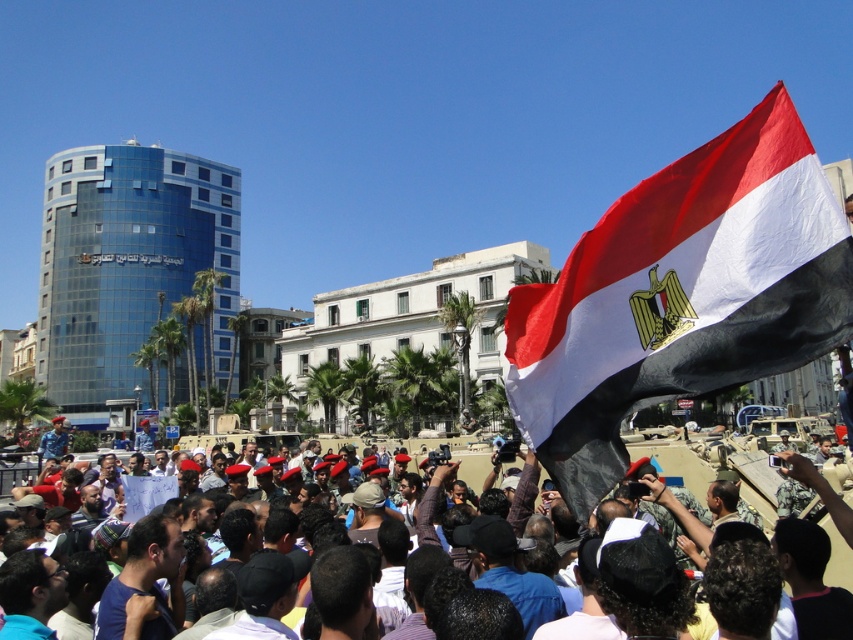
Question: Does red-white-black fabric flag at upper right appear over matte black crowd at center?

Choices:
 (A) no
 (B) yes

Answer: (B)

Question: Among these points, which one is farthest from the camera?

Choices:
 (A) click(834, 528)
 (B) click(628, 216)

Answer: (A)

Question: Can you confirm if red-white-black fabric flag at upper right is positioned to the left of matte black crowd at center?

Choices:
 (A) yes
 (B) no

Answer: (A)

Question: Which object appears closest to the camera in this image?

Choices:
 (A) matte black crowd at center
 (B) red-white-black fabric flag at upper right

Answer: (B)

Question: Can you confirm if red-white-black fabric flag at upper right is smaller than matte black crowd at center?

Choices:
 (A) no
 (B) yes

Answer: (A)